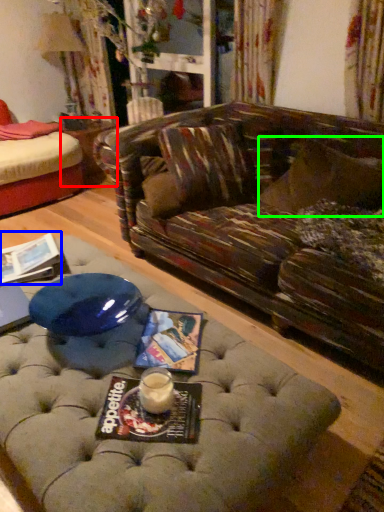
Question: Which is farther away from side table (highlighted by a red box)? magazine (highlighted by a blue box) or pillow (highlighted by a green box)?

Choices:
 (A) magazine
 (B) pillow

Answer: (B)